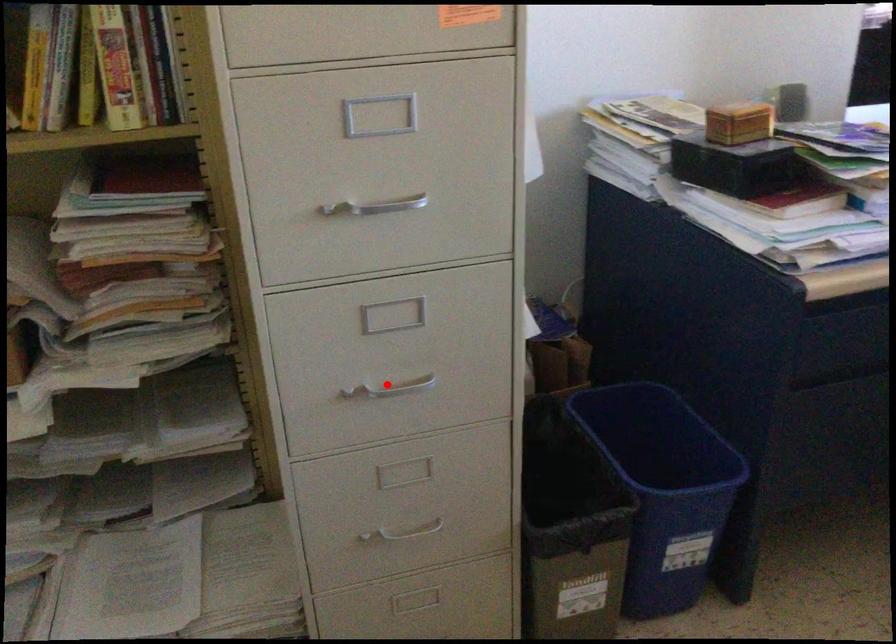
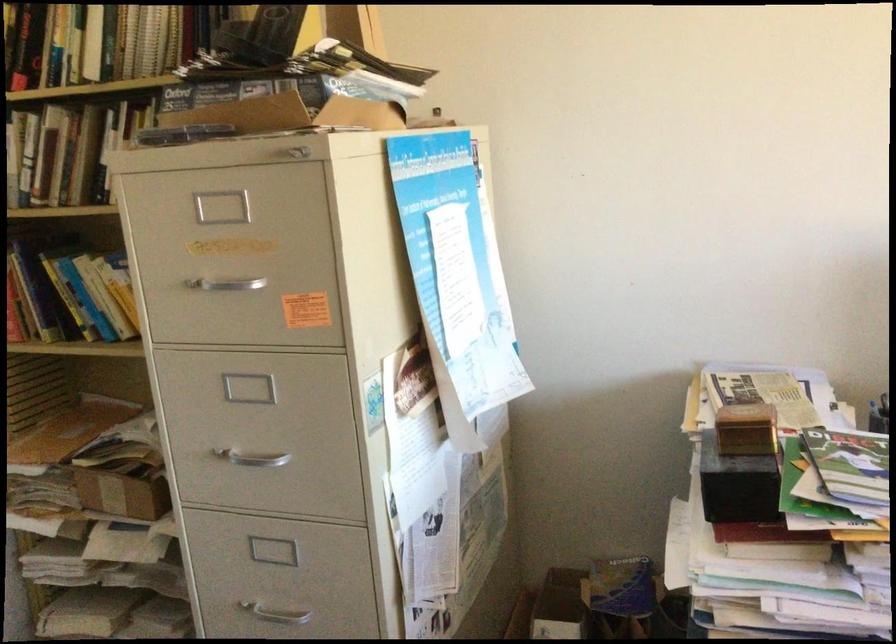
Question: I am providing you with two images of the same scene from different viewpoints. A red point is shown in image1. For the corresponding object point in image2, is it positioned nearer or farther from the camera?

Choices:
 (A) Nearer
 (B) Farther

Answer: (B)